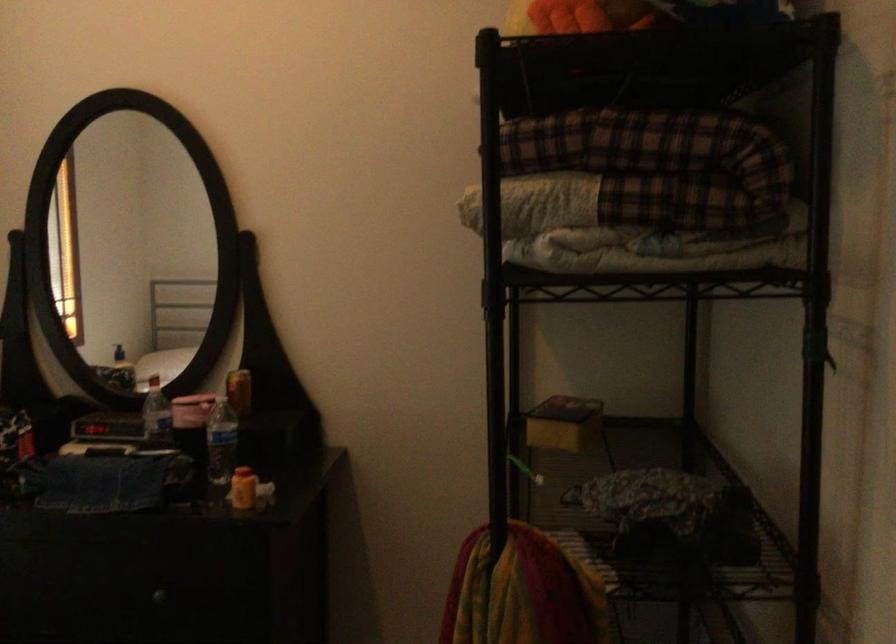
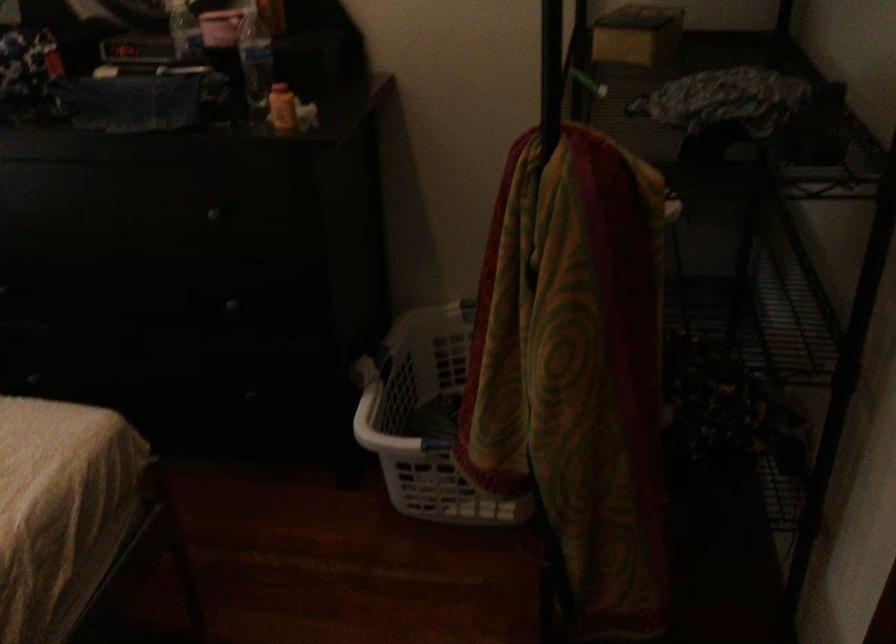
Question: The images are taken continuously from a first-person perspective. In which direction are you moving?

Choices:
 (A) Left
 (B) Right
 (C) Forward
 (D) Backward

Answer: (C)